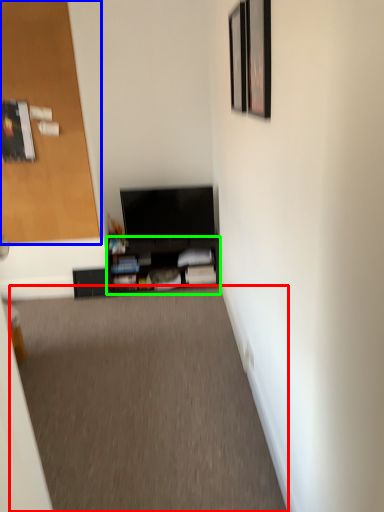
Question: Which is nearer to the plain (highlighted by a red box)? door (highlighted by a blue box) or shelf (highlighted by a green box).

Choices:
 (A) door
 (B) shelf

Answer: (B)